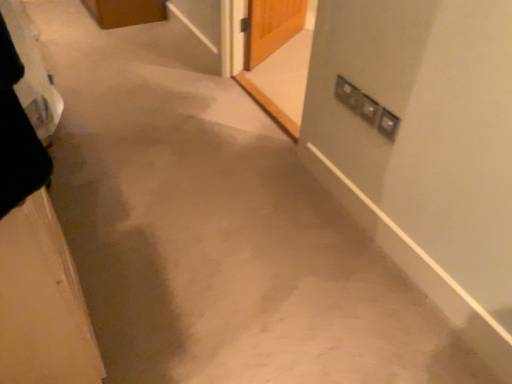
Consider the image. What is the approximate height of wooden door at left?

The height of wooden door at left is 29.29 inches.

Locate an element on the screen. The width and height of the screenshot is (512, 384). satin silver switch at upper right is located at coordinates [x=388, y=124].

I want to click on matte silver screen door at upper right, the first screen door positioned from the front, so click(278, 58).

What do you see at coordinates (204, 32) in the screenshot? I see `transparent glass screen door at upper center, which is counted as the 1th screen door, starting from the left` at bounding box center [204, 32].

Identify the location of wooden door at left. (42, 304).

From the picture: Is transparent glass screen door at upper center, the second screen door in the right-to-left sequence, a part of wooden door at left?

That's incorrect, transparent glass screen door at upper center, the second screen door in the right-to-left sequence, is not inside wooden door at left.

Who is taller, wooden door at left or transparent glass screen door at upper center, the second screen door in the right-to-left sequence?

With more height is wooden door at left.

Considering the positions of objects wooden door at left and transparent glass screen door at upper center, the second screen door in the right-to-left sequence, in the image provided, who is more to the left, wooden door at left or transparent glass screen door at upper center, the second screen door in the right-to-left sequence,?

wooden door at left is more to the left.

What's the angular difference between wooden door at left and transparent glass screen door at upper center, which is counted as the 1th screen door, starting from the left,'s facing directions?

There is a 180-degree angle between the facing directions of wooden door at left and transparent glass screen door at upper center, which is counted as the 1th screen door, starting from the left.

Which of these two, wooden door at left or satin silver switch at upper right, is wider?

wooden door at left is wider.

Is wooden door at left oriented away from satin silver switch at upper right?

No, wooden door at left's orientation is not away from satin silver switch at upper right.

From a real-world perspective, is wooden door at left under satin silver switch at upper right?

Yes, from a real-world perspective, wooden door at left is beneath satin silver switch at upper right.

In order to click on door below the satin silver switch at upper right (from a real-world perspective) in this screenshot , I will do `click(42, 304)`.

Does satin silver switch at upper right turn towards wooden door at left?

Yes.

Does satin silver switch at upper right come behind wooden door at left?

Yes, satin silver switch at upper right is further from the camera.

Which object is thinner, satin silver switch at upper right or wooden door at left?

satin silver switch at upper right.

Considering the positions of objects satin silver switch at upper right and wooden door at left in the image provided, who is more to the right, satin silver switch at upper right or wooden door at left?

Positioned to the right is satin silver switch at upper right.

Measure the distance between satin silver switch at upper right and matte silver screen door at upper right, marked as the first screen door in a right-to-left arrangement.

satin silver switch at upper right and matte silver screen door at upper right, marked as the first screen door in a right-to-left arrangement, are 1.27 meters apart.

Which is closer to the camera, (391, 133) or (251, 27)?

Point (391, 133).

Based on the photo, does satin silver switch at upper right have a smaller size compared to matte silver screen door at upper right, the second screen door viewed from the back?

Yes.

Are satin silver switch at upper right and matte silver screen door at upper right, the 2th screen door positioned from the left, far apart?

Yes, satin silver switch at upper right is far from matte silver screen door at upper right, the 2th screen door positioned from the left.

Which is closer to the camera, (217, 73) or (291, 20)?

The point (217, 73) is closer to the camera.

From a real-world perspective, is transparent glass screen door at upper center, arranged as the 2th screen door when viewed from the front, physically located above or below matte silver screen door at upper right, the 2th screen door positioned from the left?

In terms of real-world spatial position, transparent glass screen door at upper center, arranged as the 2th screen door when viewed from the front, is below matte silver screen door at upper right, the 2th screen door positioned from the left.

You are a GUI agent. You are given a task and a screenshot of the screen. Output one action in this format:
    pyautogui.click(x=<x>, y=<y>)
    Task: Click on the screen door below the matte silver screen door at upper right, marked as the first screen door in a right-to-left arrangement (from a real-world perspective)
    The image size is (512, 384).
    Given the screenshot: What is the action you would take?
    pyautogui.click(x=204, y=32)

How far apart are transparent glass screen door at upper center, which is counted as the 1th screen door, starting from the left, and matte silver screen door at upper right, the second screen door viewed from the back?

The distance of transparent glass screen door at upper center, which is counted as the 1th screen door, starting from the left, from matte silver screen door at upper right, the second screen door viewed from the back, is 15.72 inches.

From a real-world perspective, is matte silver screen door at upper right, the second screen door viewed from the back, physically above wooden door at left?

Incorrect, from a real-world perspective, matte silver screen door at upper right, the second screen door viewed from the back, is lower than wooden door at left.

Which is in front, point (307, 18) or point (53, 243)?

The point (53, 243) is in front.

From their relative heights in the image, would you say matte silver screen door at upper right, the 2th screen door positioned from the left, is taller or shorter than wooden door at left?

In the image, matte silver screen door at upper right, the 2th screen door positioned from the left, appears to be taller than wooden door at left.

In the scene shown: Could you tell me if transparent glass screen door at upper center, arranged as the 2th screen door when viewed from the front, is facing wooden door at left?

No, transparent glass screen door at upper center, arranged as the 2th screen door when viewed from the front, is not turned towards wooden door at left.

Is transparent glass screen door at upper center, which is counted as the 1th screen door, starting from the left, thinner than wooden door at left?

Yes, transparent glass screen door at upper center, which is counted as the 1th screen door, starting from the left, is thinner than wooden door at left.

How distant is transparent glass screen door at upper center, the second screen door in the right-to-left sequence, from wooden door at left?

They are 6.72 feet apart.

Considering the positions of points (210, 31) and (42, 379), is point (210, 31) farther from camera compared to point (42, 379)?

That is True.

Identify the location of door to the left of transparent glass screen door at upper center, the second screen door in the right-to-left sequence. (42, 304).

I want to click on door beneath the satin silver switch at upper right (from a real-world perspective), so click(42, 304).

When comparing their distances from wooden door at left, does matte silver screen door at upper right, the 2th screen door positioned from the left, or satin silver switch at upper right seem closer?

satin silver switch at upper right lies closer to wooden door at left than the other object.

Looking at the image, which one is located further to matte silver screen door at upper right, the first screen door positioned from the front, satin silver switch at upper right or transparent glass screen door at upper center, the 1th screen door from the back?

The object further to matte silver screen door at upper right, the first screen door positioned from the front, is satin silver switch at upper right.

Looking at the image, which one is located further to transparent glass screen door at upper center, the second screen door in the right-to-left sequence, matte silver screen door at upper right, the second screen door viewed from the back, or wooden door at left?

wooden door at left is further to transparent glass screen door at upper center, the second screen door in the right-to-left sequence.

From the image, which object appears to be nearer to satin silver switch at upper right, matte silver screen door at upper right, the second screen door viewed from the back, or wooden door at left?

wooden door at left.

Based on their spatial positions, is matte silver screen door at upper right, marked as the first screen door in a right-to-left arrangement, or satin silver switch at upper right further from transparent glass screen door at upper center, the 1th screen door from the back?

satin silver switch at upper right is further to transparent glass screen door at upper center, the 1th screen door from the back.

Based on the photo, estimate the real-world distances between objects in this image. Which object is closer to transparent glass screen door at upper center, the 1th screen door from the back, wooden door at left or matte silver screen door at upper right, the second screen door viewed from the back?

matte silver screen door at upper right, the second screen door viewed from the back, lies closer to transparent glass screen door at upper center, the 1th screen door from the back, than the other object.

Estimate the real-world distances between objects in this image. Which object is further from satin silver switch at upper right, transparent glass screen door at upper center, which is counted as the 1th screen door, starting from the left, or matte silver screen door at upper right, marked as the first screen door in a right-to-left arrangement?

Among the two, transparent glass screen door at upper center, which is counted as the 1th screen door, starting from the left, is located further to satin silver switch at upper right.

From the image, which object appears to be farther from transparent glass screen door at upper center, arranged as the 2th screen door when viewed from the front, satin silver switch at upper right or matte silver screen door at upper right, the second screen door viewed from the back?

satin silver switch at upper right is positioned further to the anchor transparent glass screen door at upper center, arranged as the 2th screen door when viewed from the front.

Where is `screen door positioned between wooden door at left and transparent glass screen door at upper center, the 1th screen door from the back, from near to far`? This screenshot has height=384, width=512. screen door positioned between wooden door at left and transparent glass screen door at upper center, the 1th screen door from the back, from near to far is located at coordinates (278, 58).

Where is `electric outlet between wooden door at left and transparent glass screen door at upper center, the 1th screen door from the back, from front to back`? The height and width of the screenshot is (384, 512). electric outlet between wooden door at left and transparent glass screen door at upper center, the 1th screen door from the back, from front to back is located at coordinates (388, 124).

You are a GUI agent. You are given a task and a screenshot of the screen. Output one action in this format:
    pyautogui.click(x=<x>, y=<y>)
    Task: Click on the electric outlet between wooden door at left and matte silver screen door at upper right, marked as the first screen door in a right-to-left arrangement, in the front-back direction
    The height and width of the screenshot is (384, 512).
    Given the screenshot: What is the action you would take?
    pyautogui.click(x=388, y=124)

Locate an element on the screen. The image size is (512, 384). screen door positioned between satin silver switch at upper right and transparent glass screen door at upper center, the 1th screen door from the back, from near to far is located at coordinates (278, 58).